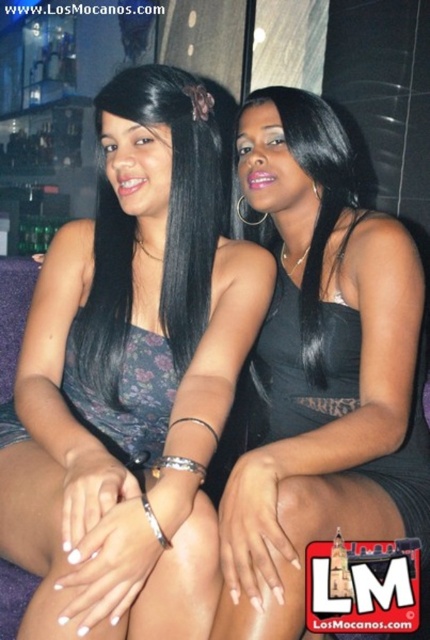
You are a photographer trying to capture a candid shot of the two people in the image. You want to ensure that both the matte floral dress at center and the black silky hair at left are clearly visible in the frame. Given their height difference, which object should you focus on to ensure both are in focus?

The matte floral dress at center is much taller than the black silky hair at left, so focusing on the matte floral dress at center would ensure both are in focus since it is the taller object.

You are at a bar and want to find the matte floral dress at center. According to the coordinates given, where would you look?

You should look at point (131,376) to find the matte floral dress at center.

You are standing in the dimly lit room and want to determine which of the two points, point [111,276] or point [214,131], is nearer to you. Based on the scene description, which point is closer?

Point [111,276] is closer to the viewer than point [214,131].